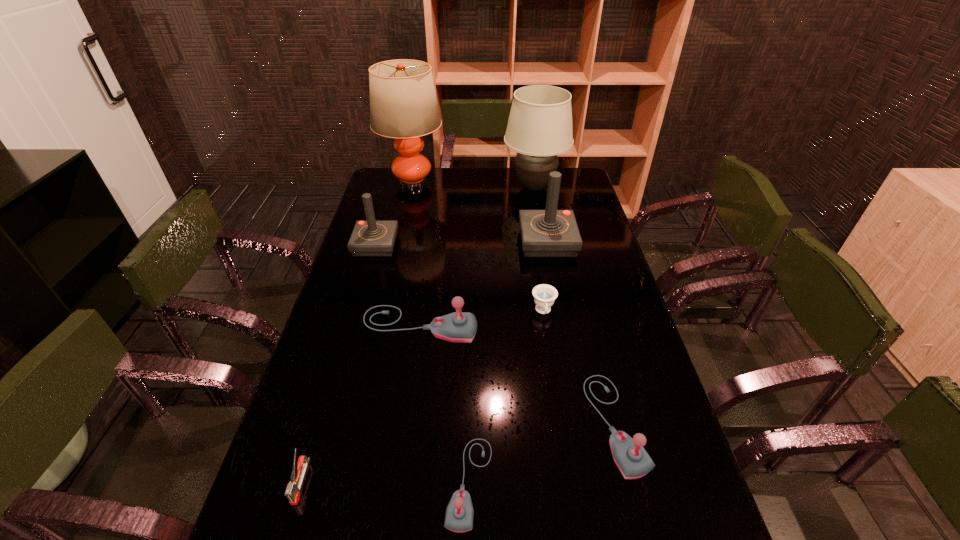
In order to click on object that can be found as the sixth closest to the gray stapler in this screenshot , I will do coord(544,233).

This screenshot has width=960, height=540. Find the location of `the third closest object to the shortest object`. the third closest object to the shortest object is located at coordinates (544, 233).

Locate an element on the screen. Image resolution: width=960 pixels, height=540 pixels. joystick that stands as the second closest to the right red joystick is located at coordinates (371, 238).

I want to click on the second closest joystick relative to the farthest gray joystick, so [544, 233].

The width and height of the screenshot is (960, 540). Find the location of `gray joystick that stands as the third closest to the teacup`. gray joystick that stands as the third closest to the teacup is located at coordinates (459, 515).

The width and height of the screenshot is (960, 540). In order to click on gray joystick identified as the closest to the sixth tallest object in this screenshot , I will do `click(459, 515)`.

Where is `vacant point that satisfies the following two spatial constraints: 1. on the front side of the tallest object; 2. on the right side of the sixth tallest object`? This screenshot has height=540, width=960. vacant point that satisfies the following two spatial constraints: 1. on the front side of the tallest object; 2. on the right side of the sixth tallest object is located at coordinates (357, 423).